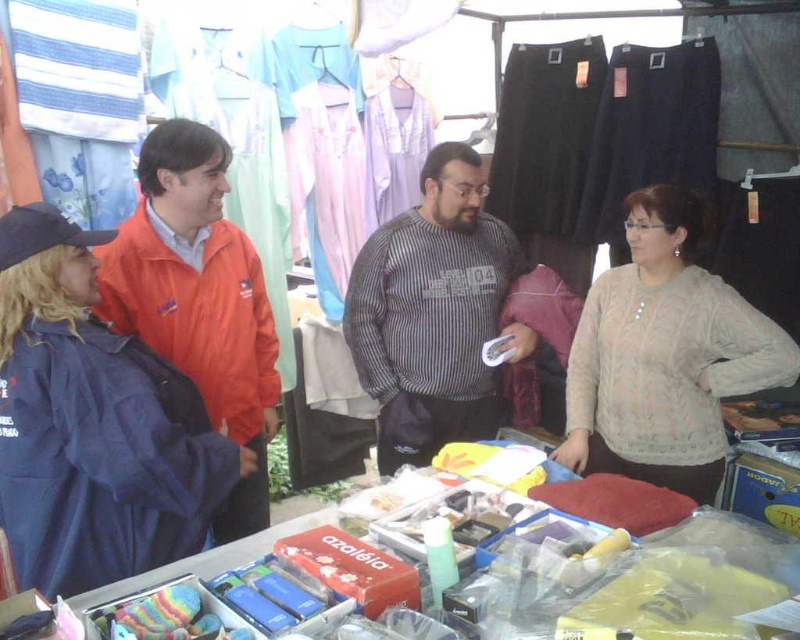
Question: Estimate the real-world distances between objects in this image. Which object is farther from the light beige knitted sweater at center?

Choices:
 (A) matte blue jacket at left
 (B) striped sweater at center

Answer: (A)

Question: Is matte blue jacket at left further to the viewer compared to light beige knitted sweater at center?

Choices:
 (A) yes
 (B) no

Answer: (B)

Question: Which of the following is the closest to the observer?

Choices:
 (A) orange fabric jacket at left
 (B) striped sweater at center

Answer: (A)

Question: Observing the image, what is the correct spatial positioning of matte blue jacket at left in reference to light beige knitted sweater at center?

Choices:
 (A) above
 (B) below

Answer: (B)

Question: Can you confirm if light beige knitted sweater at center is positioned to the left of orange fabric jacket at left?

Choices:
 (A) no
 (B) yes

Answer: (A)

Question: Which point is closer to the camera?

Choices:
 (A) light beige knitted sweater at center
 (B) orange fabric jacket at left
 (C) striped sweater at center

Answer: (B)